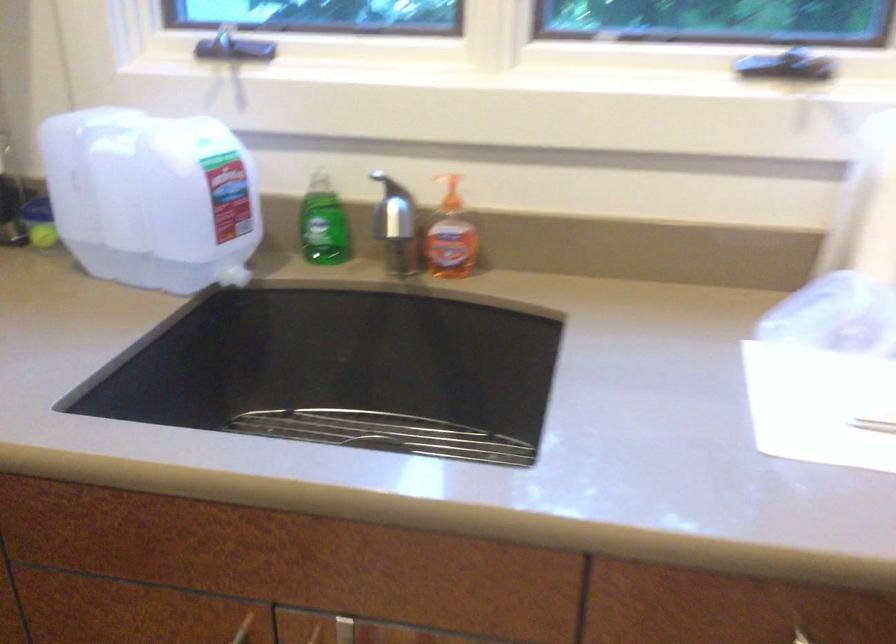
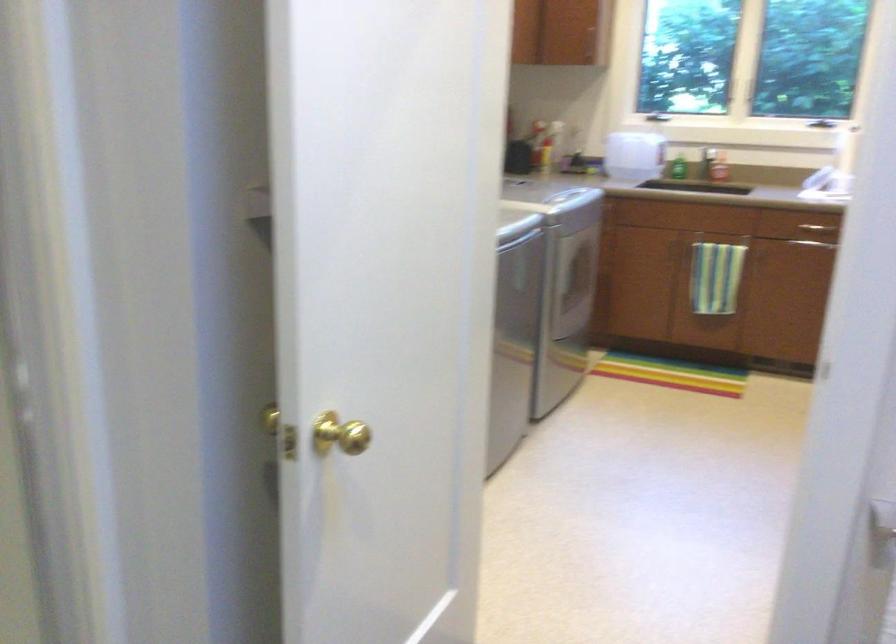
The point at (784, 126) is marked in the first image. Where is the corresponding point in the second image?

(817, 122)